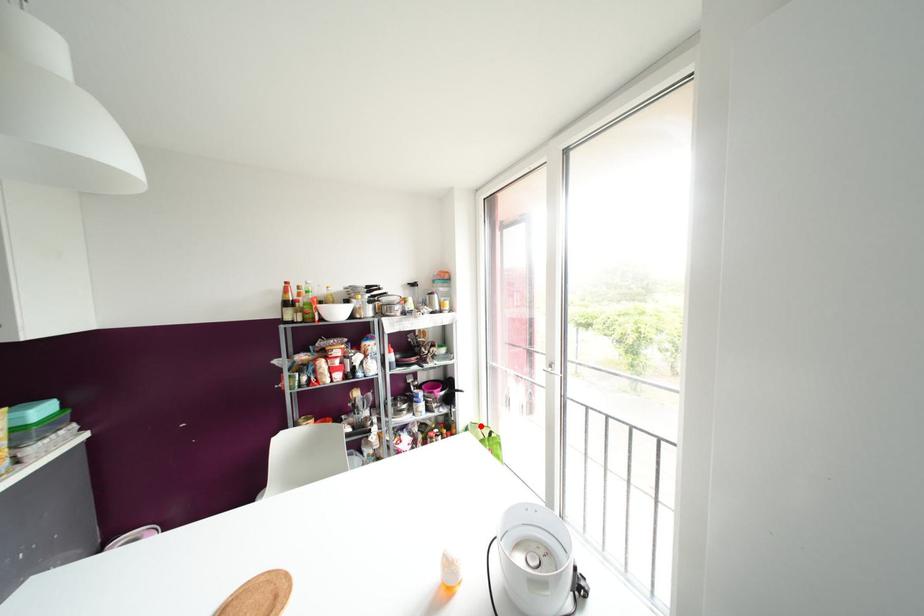
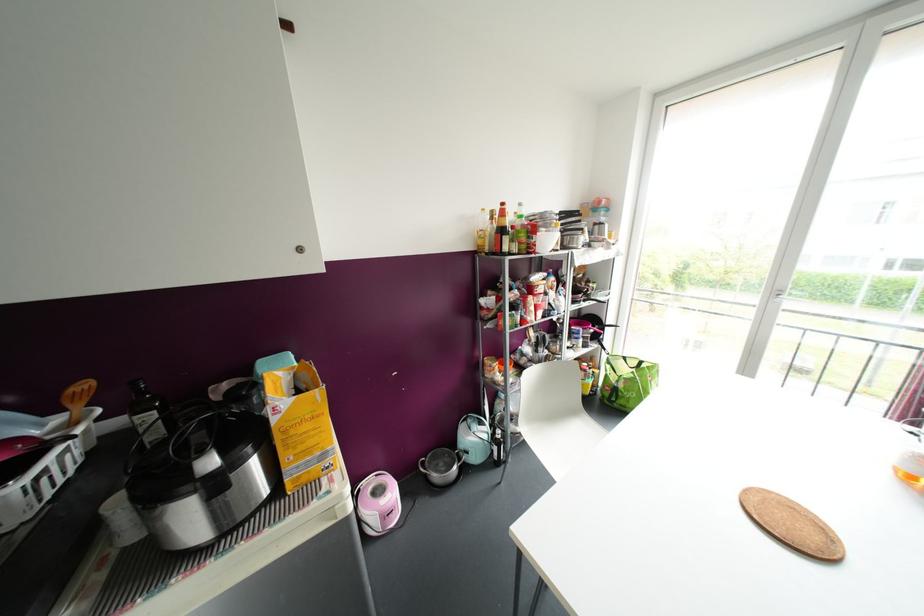
Locate, in the second image, the point that corresponds to the highlighted location in the first image.

(624, 358)